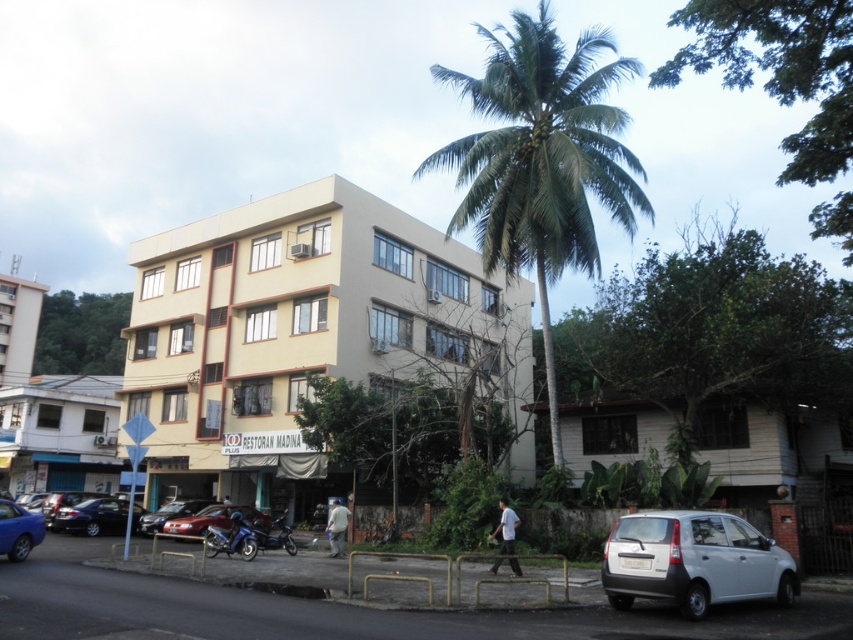
Consider the image. Can you confirm if shiny red car at lower left is shorter than shiny blue motorcycle at center?

Correct, shiny red car at lower left is not as tall as shiny blue motorcycle at center.

Between shiny red car at lower left and shiny blue motorcycle at center, which one has more height?

With more height is shiny blue motorcycle at center.

Between point (146, 525) and point (293, 554), which one is positioned in front?

Point (293, 554) is in front.

This screenshot has height=640, width=853. I want to click on shiny red car at lower left, so click(x=169, y=513).

In the scene shown: Which is more to the right, beige concrete building at center or shiny red car at lower center?

beige concrete building at center is more to the right.

Can you confirm if beige concrete building at center is positioned below shiny red car at lower center?

No.

Between point (418, 227) and point (253, 524), which one is positioned behind?

Point (418, 227)

The image size is (853, 640). What are the coordinates of `beige concrete building at center` in the screenshot? It's located at (305, 337).

Does point (84, 502) come behind point (126, 516)?

No.

Which is above, matte black car at center or shiny black sedan at lower left?

matte black car at center is above.

The image size is (853, 640). What do you see at coordinates (218, 520) in the screenshot?
I see `matte black car at center` at bounding box center [218, 520].

Where is `matte black car at center`? matte black car at center is located at coordinates (218, 520).